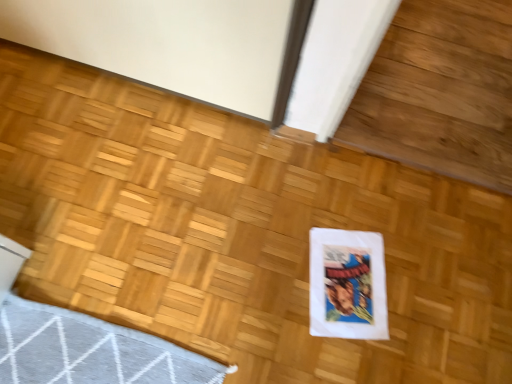
Measure the distance between point [373,254] and camera.

They are 1.24 meters apart.

What is the approximate height of white paper comic book at lower right?

white paper comic book at lower right is 1.65 centimeters tall.

Describe the element at coordinates (347, 284) in the screenshot. I see `white paper comic book at lower right` at that location.

What is the approximate width of white paper comic book at lower right?

white paper comic book at lower right is 8.25 inches wide.

In order to click on white paper comic book at lower right in this screenshot , I will do [347, 284].

Find the location of `white paper comic book at lower right`. white paper comic book at lower right is located at coordinates (347, 284).